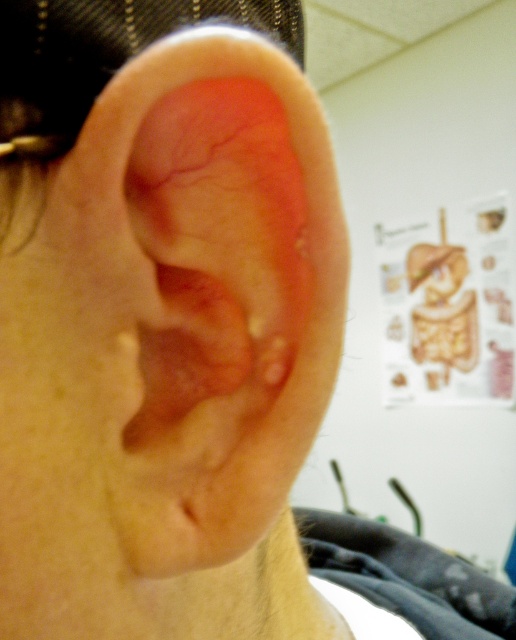
Which is behind, point (166, 326) or point (414, 268)?

Point (414, 268)

Which is more to the right, pink flesh at center or matte skin forehead at upper center?

From the viewer's perspective, matte skin forehead at upper center appears more on the right side.

Identify the location of pink flesh at center. (194, 340).

Between pink flesh-colored ear at center and pink flesh at center, which one appears on the left side from the viewer's perspective?

pink flesh at center

Is point (244, 344) positioned after point (173, 323)?

Yes, point (244, 344) is farther from viewer.

Where is `pink flesh-colored ear at center`? pink flesh-colored ear at center is located at coordinates (201, 292).

How distant is pink flesh-colored ear at center from matte skin forehead at upper center?

They are 7.70 feet apart.

Is point (172, 385) closer to viewer compared to point (444, 253)?

Yes, point (172, 385) is closer to viewer.

Describe the element at coordinates (201, 292) in the screenshot. Image resolution: width=516 pixels, height=640 pixels. I see `pink flesh-colored ear at center` at that location.

This screenshot has width=516, height=640. What are the coordinates of `pink flesh-colored ear at center` in the screenshot? It's located at (201, 292).